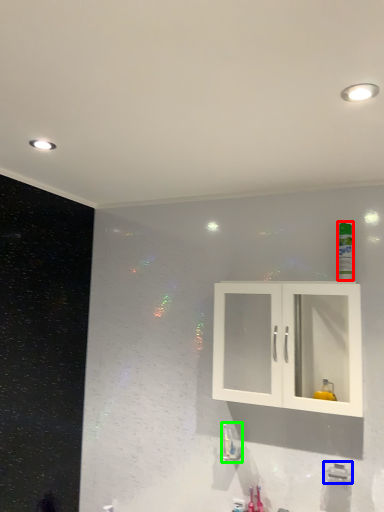
Question: Estimate the real-world distances between objects in this image. Which object is farther from mouthwash (highlighted by a red box), plumbing fixture (highlighted by a blue box) or plumbing fixture (highlighted by a green box)?

Choices:
 (A) plumbing fixture
 (B) plumbing fixture

Answer: (B)